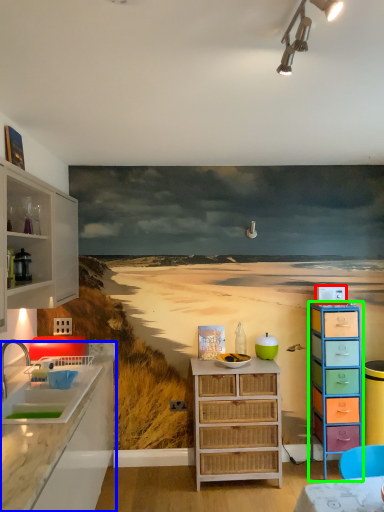
Question: Estimate the real-world distances between objects in this image. Which object is closer to appliance (highlighted by a red box), countertop (highlighted by a blue box) or chest of drawers (highlighted by a green box)?

Choices:
 (A) countertop
 (B) chest of drawers

Answer: (B)